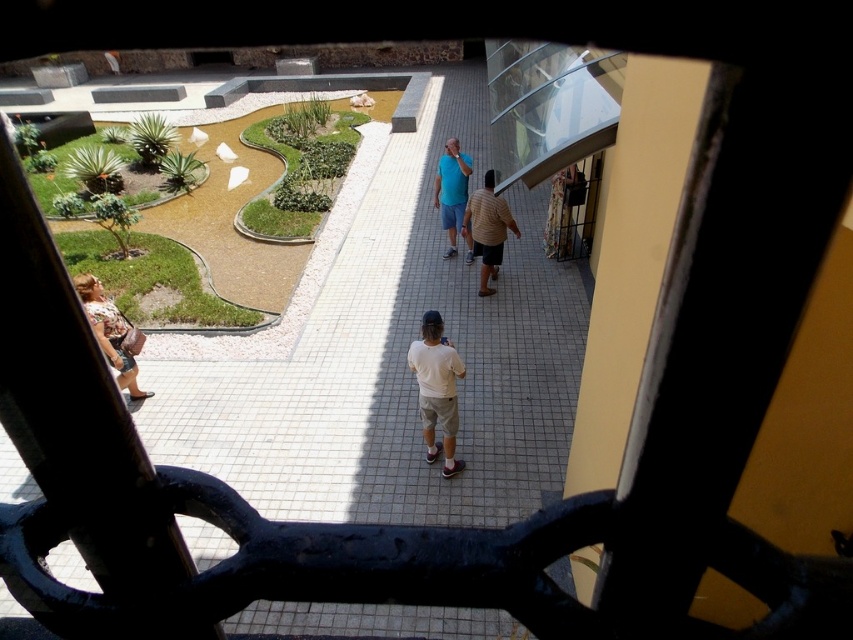
Does striped shirt at center appear over blue fabric shirt at center?

Actually, striped shirt at center is below blue fabric shirt at center.

Between point (485, 212) and point (467, 227), which one is positioned behind?

Point (467, 227)

Does point (485, 292) come closer to viewer compared to point (444, 166)?

Yes, it is.

Locate an element on the screen. This screenshot has width=853, height=640. striped shirt at center is located at coordinates (486, 228).

Between white tile floor at center and floral dress at lower left, which one appears on the right side from the viewer's perspective?

white tile floor at center

From the picture: How far apart are white tile floor at center and floral dress at lower left?

white tile floor at center is 3.88 meters from floral dress at lower left.

Is point (166, 348) less distant than point (80, 285)?

No.

The image size is (853, 640). What are the coordinates of `white tile floor at center` in the screenshot? It's located at (392, 364).

Is white cotton shirt at center taller than striped shirt at center?

No.

Between white cotton shirt at center and striped shirt at center, which one appears on the right side from the viewer's perspective?

From the viewer's perspective, striped shirt at center appears more on the right side.

Locate an element on the screen. Image resolution: width=853 pixels, height=640 pixels. white cotton shirt at center is located at coordinates (x=437, y=388).

Locate an element on the screen. The width and height of the screenshot is (853, 640). white cotton shirt at center is located at coordinates (437, 388).